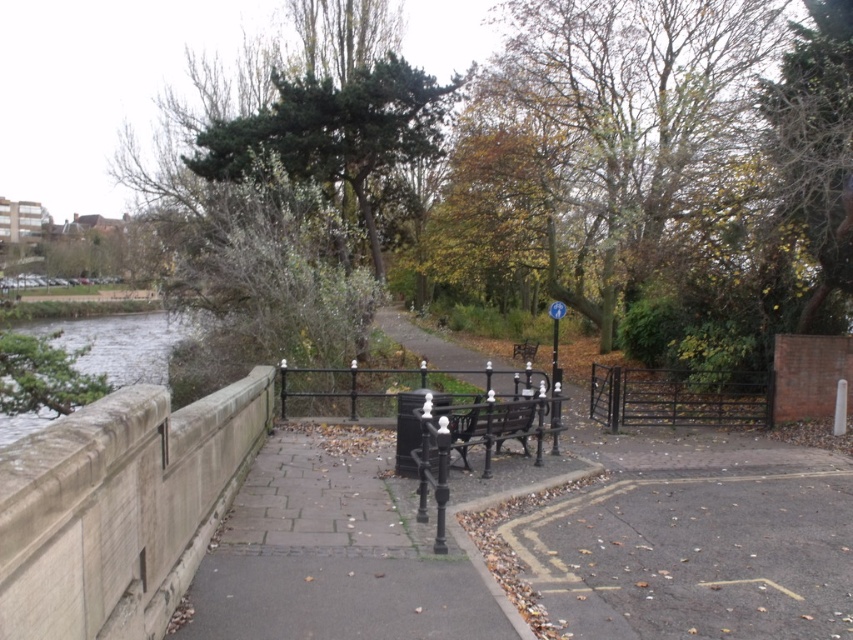
You are standing at the starting point of the pathway and want to reach the end of the path. Which of the two points, point (511, 68) or point (68, 339), is closer to the end of the path?

Point (68, 339) is closer to the end of the path because it is behind point (511, 68).